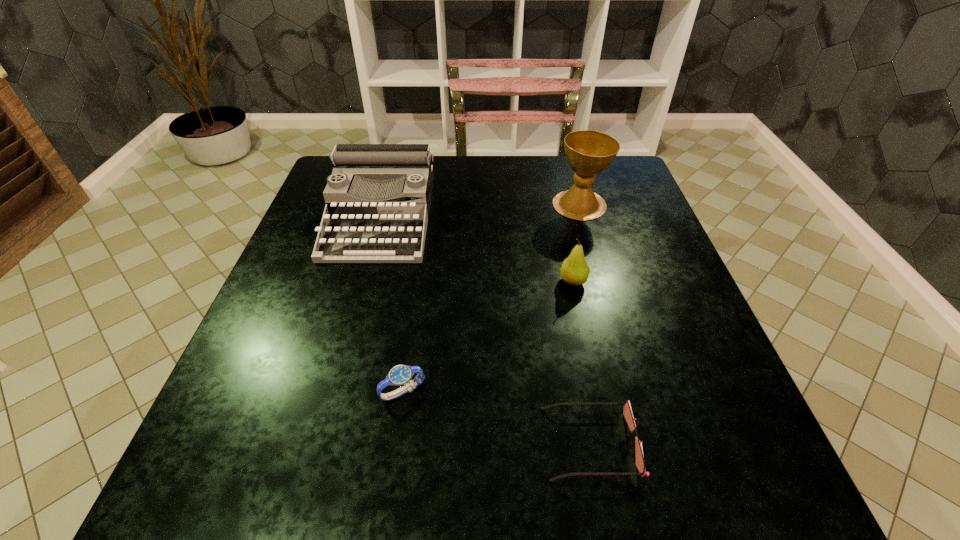
The image size is (960, 540). I want to click on vacant region that satisfies the following two spatial constraints: 1. on the typing side of the typewriter; 2. on the left side of the second nearest object, so click(332, 392).

Image resolution: width=960 pixels, height=540 pixels. I want to click on free space in the image that satisfies the following two spatial constraints: 1. on the front side of the tallest object; 2. on the bridge of the nearest object, so click(646, 443).